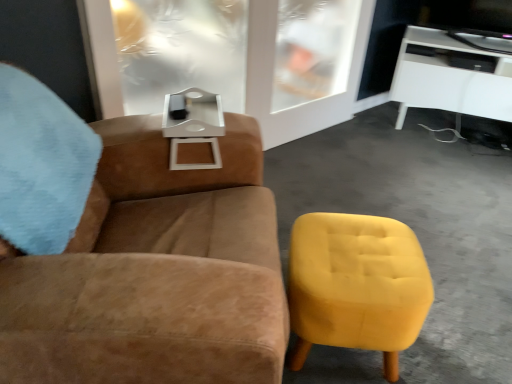
Question: Is suede brown armchair at upper left further to camera compared to white glossy tv stand at upper right?

Choices:
 (A) no
 (B) yes

Answer: (A)

Question: From a real-world perspective, does suede brown armchair at upper left stand above white glossy tv stand at upper right?

Choices:
 (A) no
 (B) yes

Answer: (B)

Question: From a real-world perspective, is suede brown armchair at upper left below white glossy tv stand at upper right?

Choices:
 (A) no
 (B) yes

Answer: (A)

Question: Considering the relative sizes of suede brown armchair at upper left and white glossy tv stand at upper right in the image provided, is suede brown armchair at upper left thinner than white glossy tv stand at upper right?

Choices:
 (A) no
 (B) yes

Answer: (A)

Question: Considering the relative sizes of suede brown armchair at upper left and white glossy tv stand at upper right in the image provided, is suede brown armchair at upper left bigger than white glossy tv stand at upper right?

Choices:
 (A) yes
 (B) no

Answer: (A)

Question: Is suede brown armchair at upper left shorter than white glossy tv stand at upper right?

Choices:
 (A) no
 (B) yes

Answer: (A)

Question: Is suede brown armchair at upper left next to transparent glass door at upper center?

Choices:
 (A) yes
 (B) no

Answer: (B)

Question: Is suede brown armchair at upper left surrounding transparent glass door at upper center?

Choices:
 (A) yes
 (B) no

Answer: (B)

Question: Is suede brown armchair at upper left taller than transparent glass door at upper center?

Choices:
 (A) yes
 (B) no

Answer: (A)

Question: Is suede brown armchair at upper left positioned before transparent glass door at upper center?

Choices:
 (A) yes
 (B) no

Answer: (A)

Question: From the image's perspective, does suede brown armchair at upper left appear higher than transparent glass door at upper center?

Choices:
 (A) yes
 (B) no

Answer: (B)

Question: Is suede brown armchair at upper left aimed at transparent glass door at upper center?

Choices:
 (A) no
 (B) yes

Answer: (A)

Question: From the image's perspective, is white glossy tv stand at upper right below suede brown armchair at upper left?

Choices:
 (A) yes
 (B) no

Answer: (B)